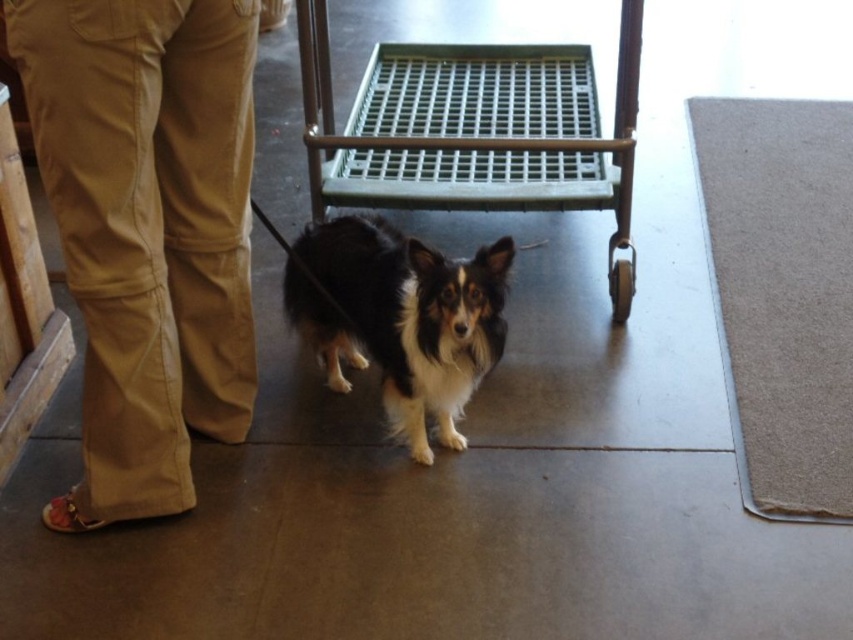
You are a security camera monitoring the room. You notice the tan cotton pants at lower left and the black and white fur dog at center. Which object is positioned higher in the image?

The tan cotton pants at lower left is above the black and white fur dog at center, so the tan cotton pants at lower left is higher in the image.

You are a photographer setting up equipment in the room. You need to place a large camera tripod between the tan cotton pants at lower left and the metallic grid cart at center. Which object should you position the tripod closer to to ensure it doesn

The tan cotton pants at lower left has a smaller size compared to the metallic grid cart at center. To place the tripod closer to the smaller object, position it nearer to the tan cotton pants at lower left.

You are a photographer setting up a shoot with the metallic grid cart at center and the black and white fur dog at center. To ensure the dog stays in frame, which object should you place closer to the camera?

The black and white fur dog at center should be placed closer to the camera since the metallic grid cart at center is positioned to its right, meaning the dog is closer to the photographer.